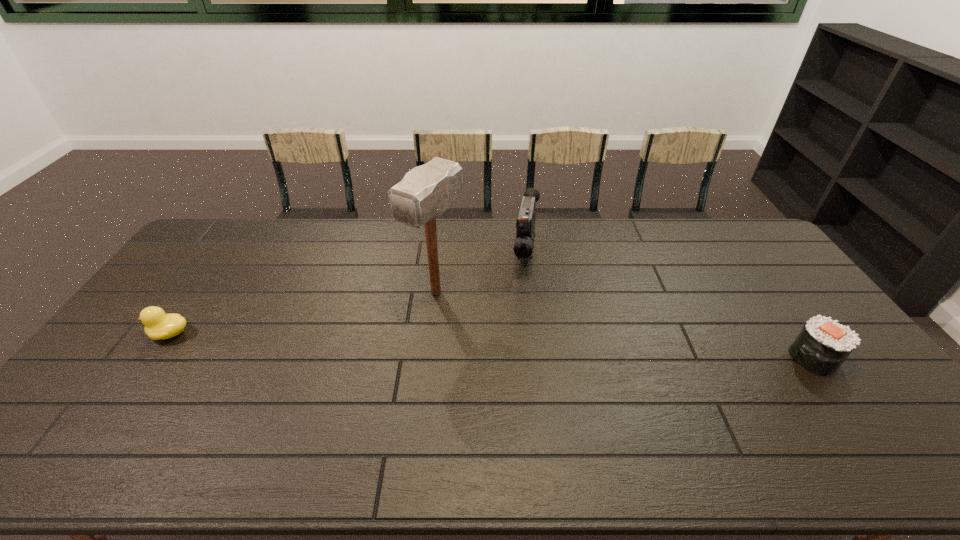
The height and width of the screenshot is (540, 960). I want to click on vacant space positioned 0.150m on the front-facing side of the second object from right to left, so click(x=523, y=312).

Where is `free space located 0.080m on the striking face of the second object from left to right`? Image resolution: width=960 pixels, height=540 pixels. free space located 0.080m on the striking face of the second object from left to right is located at coordinates (402, 330).

The height and width of the screenshot is (540, 960). Identify the location of vacant space located 0.390m on the striking face of the second object from left to right. (326, 411).

Locate an element on the screen. Image resolution: width=960 pixels, height=540 pixels. free space located on the striking face of the second object from left to right is located at coordinates (369, 366).

Where is `object at the far edge`? This screenshot has height=540, width=960. object at the far edge is located at coordinates coord(525,225).

Identify the location of object that is at the left edge. Image resolution: width=960 pixels, height=540 pixels. (158, 325).

Identify the location of object located in the right edge section of the desktop. point(822,345).

In order to click on vacant region at the far edge of the desktop in this screenshot , I will do `click(593, 247)`.

This screenshot has width=960, height=540. In the image, there is a desktop. Find the location of `vacant space at the near edge`. vacant space at the near edge is located at coordinates (459, 414).

This screenshot has height=540, width=960. Find the location of `free spot at the left edge of the desktop`. free spot at the left edge of the desktop is located at coordinates (218, 278).